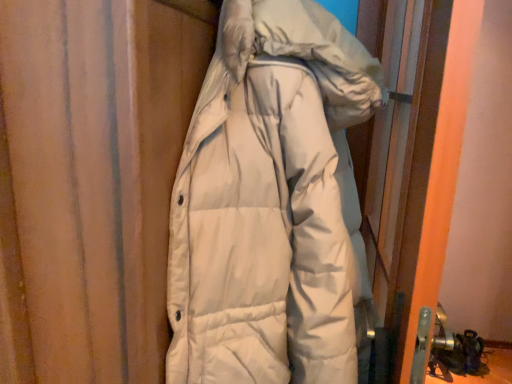
Identify the location of white down jacket at center. (268, 202).

What do you see at coordinates (268, 202) in the screenshot? I see `white down jacket at center` at bounding box center [268, 202].

The image size is (512, 384). What do you see at coordinates (402, 177) in the screenshot? I see `white matte screen door at right` at bounding box center [402, 177].

Find the location of a particular element. white matte screen door at right is located at coordinates (402, 177).

Find the location of a particular element. The width and height of the screenshot is (512, 384). white down jacket at center is located at coordinates (268, 202).

Is white down jacket at center to the right of white matte screen door at right from the viewer's perspective?

No, white down jacket at center is not to the right of white matte screen door at right.

Between white down jacket at center and white matte screen door at right, which one is positioned behind?

white matte screen door at right is behind.

Is point (311, 252) in front of point (424, 373)?

Yes, point (311, 252) is in front of point (424, 373).

From the image's perspective, which one is positioned lower, white down jacket at center or white matte screen door at right?

white matte screen door at right.

From a real-world perspective, which is physically below, white down jacket at center or white matte screen door at right?

From a 3D spatial view, white matte screen door at right is below.

Which of these two, white down jacket at center or white matte screen door at right, is wider?

Wider between the two is white down jacket at center.

Which of these two, white down jacket at center or white matte screen door at right, stands taller?

With more height is white matte screen door at right.

From the picture: Can you confirm if white down jacket at center is smaller than white matte screen door at right?

Incorrect, white down jacket at center is not smaller in size than white matte screen door at right.

Is white down jacket at center spatially inside white matte screen door at right, or outside of it?

white down jacket at center is located beyond the bounds of white matte screen door at right.

Is white down jacket at center next to white matte screen door at right and touching it?

No, white down jacket at center is not in contact with white matte screen door at right.

Is white down jacket at center positioned with its back to white matte screen door at right?

That's not correct — white down jacket at center is not looking away from white matte screen door at right.

This screenshot has width=512, height=384. I want to click on jacket that is above the white matte screen door at right (from the image's perspective), so 268,202.

Is white matte screen door at right to the right of white down jacket at center from the viewer's perspective?

Indeed, white matte screen door at right is positioned on the right side of white down jacket at center.

Is white matte screen door at right further to the viewer compared to white down jacket at center?

That is True.

Considering the points (368, 13) and (218, 200), which point is behind, point (368, 13) or point (218, 200)?

Positioned behind is point (368, 13).

From the image's perspective, is white matte screen door at right on top of white down jacket at center?

No.

From a real-world perspective, relative to white down jacket at center, is white matte screen door at right vertically above or below?

white matte screen door at right is below white down jacket at center.

Considering the relative sizes of white matte screen door at right and white down jacket at center in the image provided, is white matte screen door at right thinner than white down jacket at center?

Correct, the width of white matte screen door at right is less than that of white down jacket at center.

Is white matte screen door at right taller than white down jacket at center?

Indeed, white matte screen door at right has a greater height compared to white down jacket at center.

Considering the sizes of white matte screen door at right and white down jacket at center in the image, is white matte screen door at right bigger or smaller than white down jacket at center?

In the image, white matte screen door at right appears to be smaller than white down jacket at center.

Which is correct: white matte screen door at right is inside white down jacket at center, or outside of it?

white matte screen door at right is spatially situated outside white down jacket at center.

Is there a large distance between white matte screen door at right and white down jacket at center?

Actually, white matte screen door at right and white down jacket at center are a little close together.

Consider the image. Is white down jacket at center at the back of white matte screen door at right?

Yes.

How distant is white matte screen door at right from white down jacket at center?

white matte screen door at right and white down jacket at center are 7.39 inches apart from each other.

I want to click on jacket that is on the left side of white matte screen door at right, so click(268, 202).

Identify the location of screen door below the white down jacket at center (from a real-world perspective). (x=402, y=177).

Locate an element on the screen. Image resolution: width=512 pixels, height=384 pixels. jacket above the white matte screen door at right (from the image's perspective) is located at coordinates (268, 202).